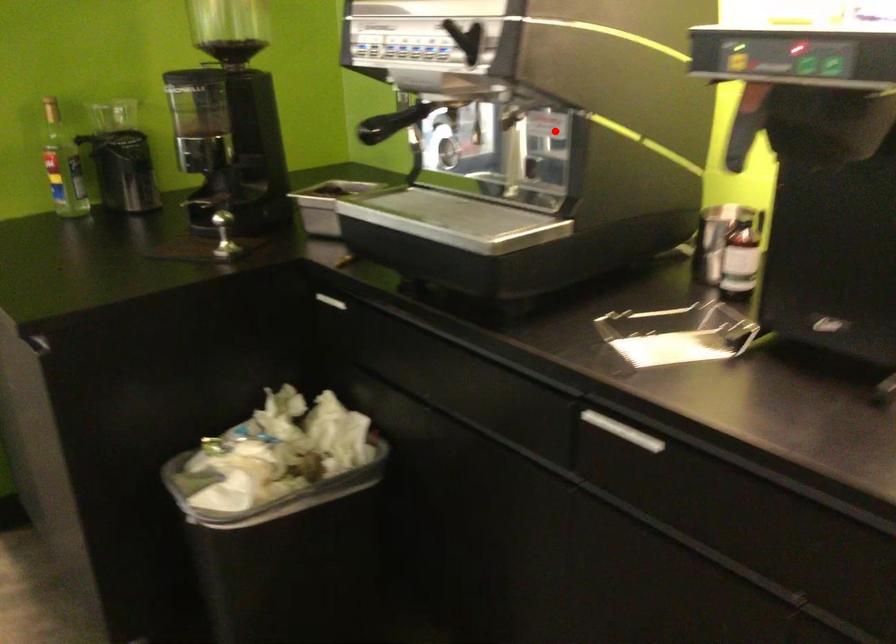
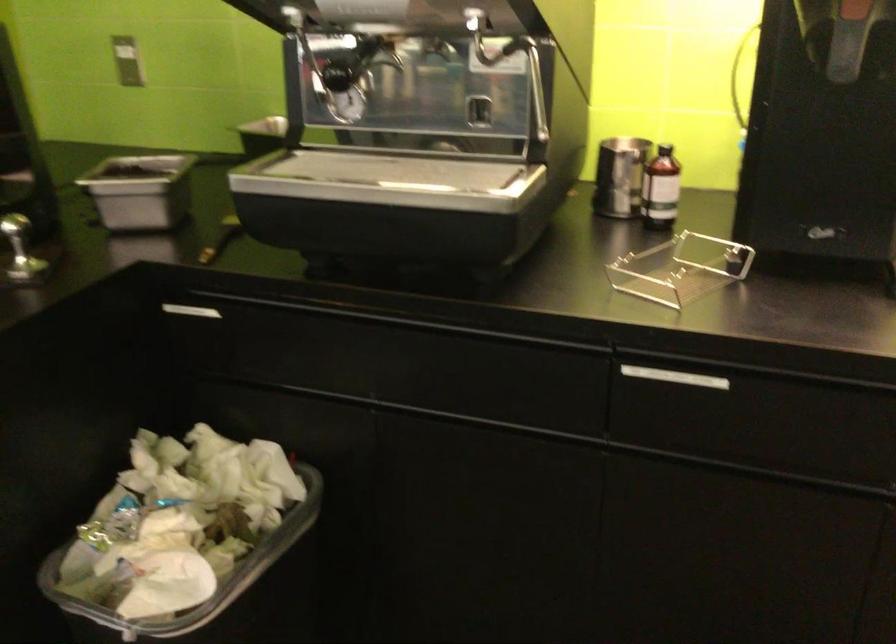
The point at the highlighted location is marked in the first image. Where is the corresponding point in the second image?

(513, 64)